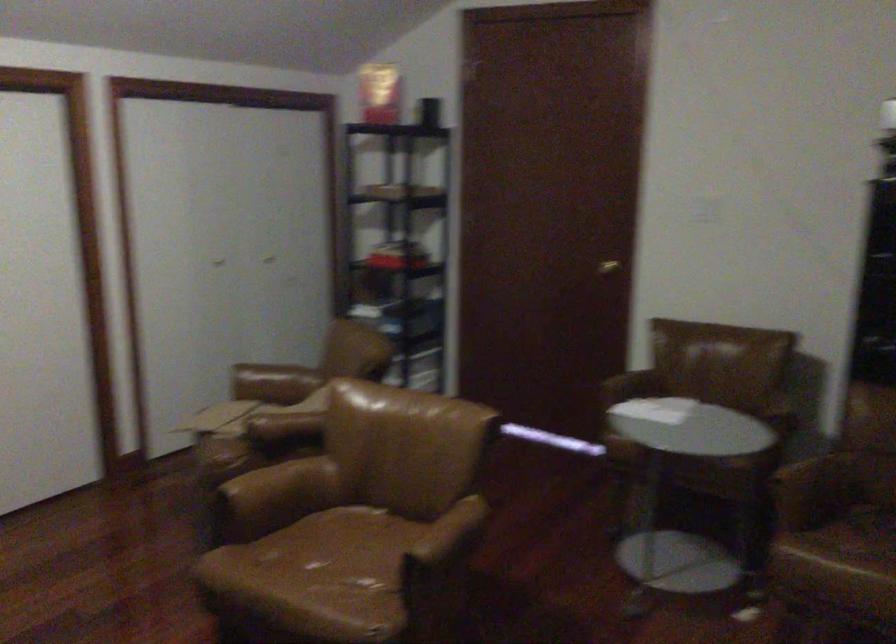
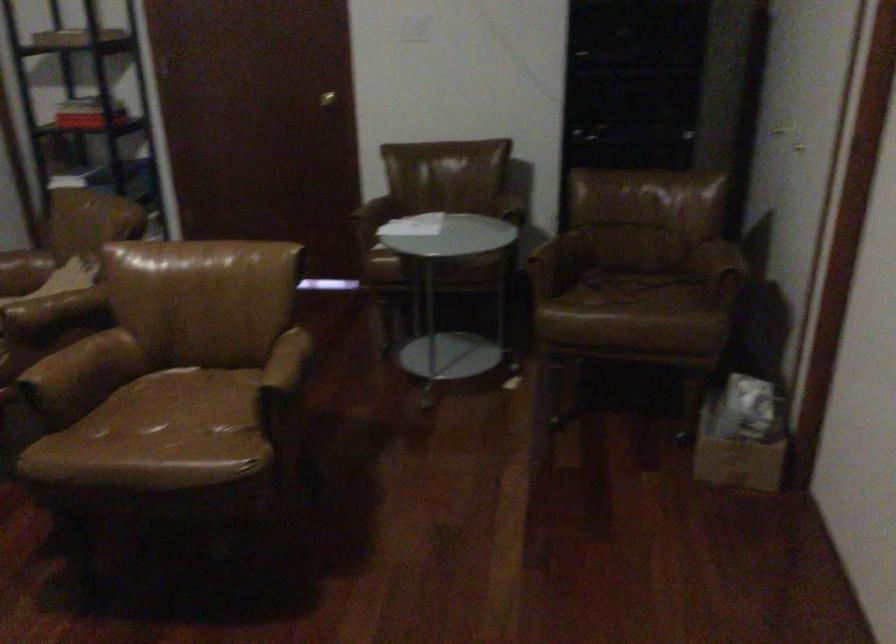
Find the pixel in the second image that matches point 262,484 in the first image.

(61, 361)